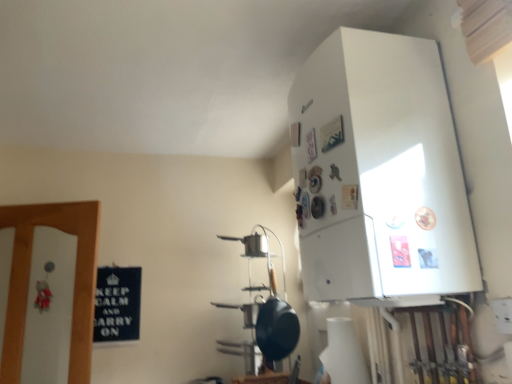
Question: From a real-world perspective, is black matte wok at center physically below white glossy refrigerator at upper right?

Choices:
 (A) yes
 (B) no

Answer: (A)

Question: Does black matte wok at center have a lesser width compared to white glossy refrigerator at upper right?

Choices:
 (A) no
 (B) yes

Answer: (B)

Question: Is black matte wok at center oriented away from white glossy refrigerator at upper right?

Choices:
 (A) yes
 (B) no

Answer: (B)

Question: Is black matte wok at center outside of white glossy refrigerator at upper right?

Choices:
 (A) no
 (B) yes

Answer: (B)

Question: Can you confirm if black matte wok at center is bigger than white glossy refrigerator at upper right?

Choices:
 (A) no
 (B) yes

Answer: (A)

Question: Is the position of black matte wok at center less distant than that of white glossy refrigerator at upper right?

Choices:
 (A) yes
 (B) no

Answer: (B)

Question: Is white glossy refrigerator at upper right positioned in front of black matte wok at center?

Choices:
 (A) no
 (B) yes

Answer: (B)

Question: From the image's perspective, does white glossy refrigerator at upper right appear higher than black matte wok at center?

Choices:
 (A) yes
 (B) no

Answer: (A)

Question: From a real-world perspective, is white glossy refrigerator at upper right beneath black matte wok at center?

Choices:
 (A) no
 (B) yes

Answer: (A)

Question: Does white glossy refrigerator at upper right appear on the left side of black matte wok at center?

Choices:
 (A) no
 (B) yes

Answer: (A)

Question: Would you say black matte wok at center is part of white glossy refrigerator at upper right's contents?

Choices:
 (A) no
 (B) yes

Answer: (A)

Question: Is black matte wok at center at the back of white glossy refrigerator at upper right?

Choices:
 (A) no
 (B) yes

Answer: (A)

Question: Does point (349, 213) appear closer or farther from the camera than point (269, 264)?

Choices:
 (A) farther
 (B) closer

Answer: (B)